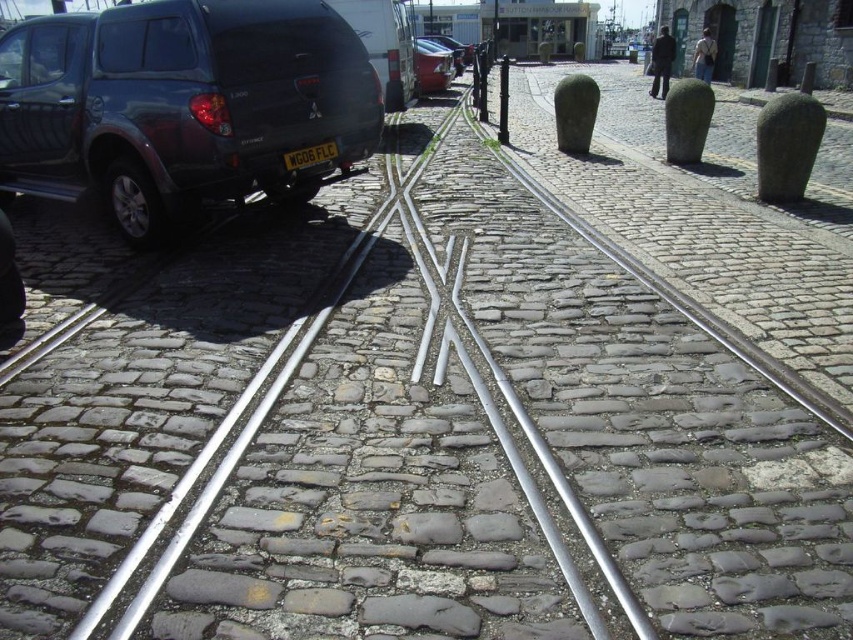
Question: Can you confirm if shiny red car at center is thinner than metallic pole at center?

Choices:
 (A) no
 (B) yes

Answer: (B)

Question: Is shiny red car at center to the left of black plastic license plate at center from the viewer's perspective?

Choices:
 (A) no
 (B) yes

Answer: (A)

Question: Which object is closer to the camera taking this photo?

Choices:
 (A) metallic red car at center
 (B) shiny red car at center

Answer: (B)

Question: Is shiny red car at center thinner than metallic red car at center?

Choices:
 (A) yes
 (B) no

Answer: (A)

Question: Which is farther from the shiny red car at center?

Choices:
 (A) black plastic license plate at center
 (B) metallic pole at center

Answer: (A)

Question: Based on their relative distances, which object is nearer to the shiny red car at center?

Choices:
 (A) metallic red car at center
 (B) metallic pole at center
 (C) black plastic license plate at center

Answer: (B)